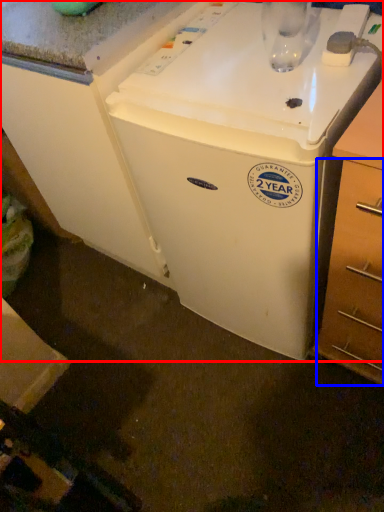
Question: Which point is further to the camera, home appliance (highlighted by a red box) or drawer (highlighted by a blue box)?

Choices:
 (A) home appliance
 (B) drawer

Answer: (A)